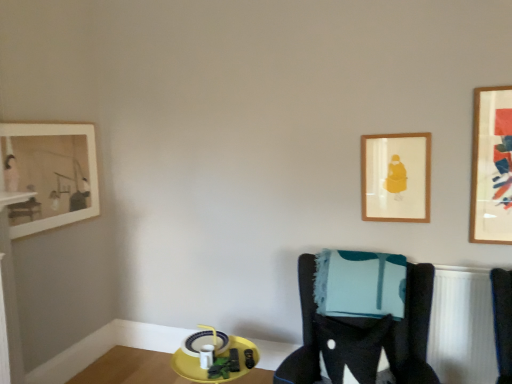
Question: Considering the relative positions of velvet black chair at center and matte white picture frame at upper left, which is the 3th picture frame from right to left, in the image provided, is velvet black chair at center to the right of matte white picture frame at upper left, which is the 3th picture frame from right to left, from the viewer's perspective?

Choices:
 (A) yes
 (B) no

Answer: (A)

Question: Is velvet black chair at center to the left of matte white picture frame at upper left, the 1th picture frame viewed from the left, from the viewer's perspective?

Choices:
 (A) no
 (B) yes

Answer: (A)

Question: Is velvet black chair at center bigger than matte white picture frame at upper left, which is the 3th picture frame from right to left?

Choices:
 (A) yes
 (B) no

Answer: (A)

Question: Considering the relative sizes of velvet black chair at center and matte white picture frame at upper left, which is the 3th picture frame from right to left, in the image provided, is velvet black chair at center taller than matte white picture frame at upper left, which is the 3th picture frame from right to left,?

Choices:
 (A) yes
 (B) no

Answer: (A)

Question: Is velvet black chair at center shorter than matte white picture frame at upper left, the 1th picture frame viewed from the left?

Choices:
 (A) yes
 (B) no

Answer: (B)

Question: Is velvet black chair at center not near matte white picture frame at upper left, which is the 3th picture frame from right to left?

Choices:
 (A) yes
 (B) no

Answer: (A)

Question: Considering the relative sizes of wooden framed artwork at upper right, arranged as the third picture frame when viewed from the left, and velvet black chair at center in the image provided, is wooden framed artwork at upper right, arranged as the third picture frame when viewed from the left, bigger than velvet black chair at center?

Choices:
 (A) yes
 (B) no

Answer: (B)

Question: Is the depth of wooden framed artwork at upper right, positioned as the first picture frame in right-to-left order, greater than that of velvet black chair at center?

Choices:
 (A) no
 (B) yes

Answer: (B)

Question: Is wooden framed artwork at upper right, arranged as the third picture frame when viewed from the left, looking in the opposite direction of velvet black chair at center?

Choices:
 (A) no
 (B) yes

Answer: (A)

Question: Is wooden framed artwork at upper right, arranged as the third picture frame when viewed from the left, not inside velvet black chair at center?

Choices:
 (A) yes
 (B) no

Answer: (A)

Question: Does wooden framed artwork at upper right, arranged as the third picture frame when viewed from the left, contain velvet black chair at center?

Choices:
 (A) no
 (B) yes

Answer: (A)

Question: Does wooden framed artwork at upper right, arranged as the third picture frame when viewed from the left, come in front of velvet black chair at center?

Choices:
 (A) no
 (B) yes

Answer: (A)

Question: From the image's perspective, is yellow plastic tray at lower center over velvet black chair at center?

Choices:
 (A) yes
 (B) no

Answer: (B)